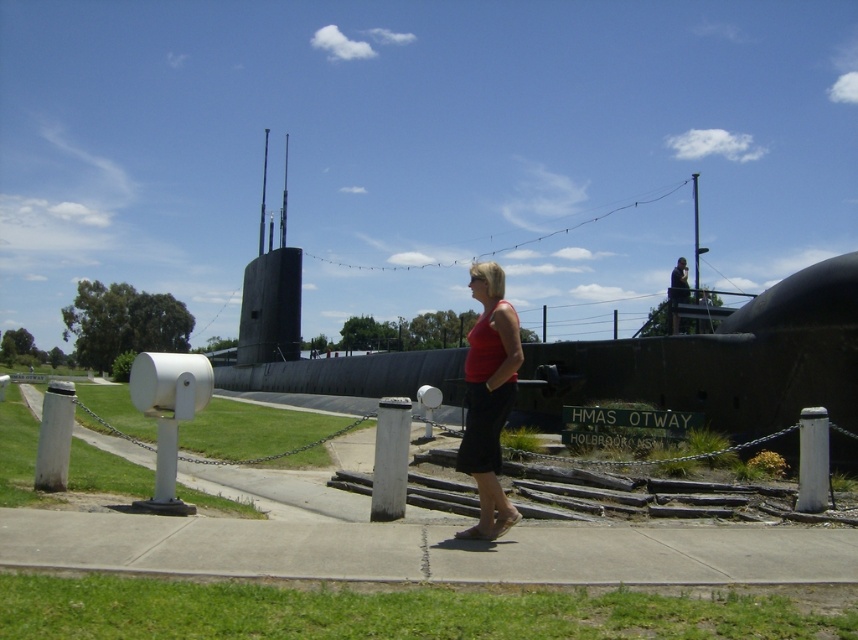
Question: Is black matte submarine at center thinner than red matte tank top at center?

Choices:
 (A) yes
 (B) no

Answer: (B)

Question: Does black matte submarine at center have a lesser width compared to red matte tank top at center?

Choices:
 (A) no
 (B) yes

Answer: (A)

Question: Which point is farther to the camera?

Choices:
 (A) black matte submarine at center
 (B) red matte tank top at center

Answer: (A)

Question: Can you confirm if black matte submarine at center is thinner than red matte tank top at center?

Choices:
 (A) no
 (B) yes

Answer: (A)

Question: Which point is farther to the camera?

Choices:
 (A) red matte tank top at center
 (B) black matte submarine at center

Answer: (B)